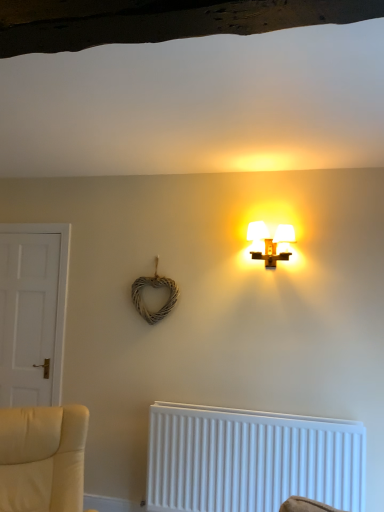
Find the location of `white plastic radiator at lower center`. white plastic radiator at lower center is located at coordinates (251, 460).

What do you see at coordinates (270, 242) in the screenshot?
I see `matte white lamp at upper center` at bounding box center [270, 242].

This screenshot has height=512, width=384. Describe the element at coordinates (28, 317) in the screenshot. I see `white matte door at left` at that location.

The height and width of the screenshot is (512, 384). Identify the location of white plastic radiator at lower center. tap(251, 460).

Is the surface of white plastic radiator at lower center in direct contact with white matte door at left?

They are not placed beside each other.

Does white plastic radiator at lower center have a lesser width compared to white matte door at left?

No, white plastic radiator at lower center is not thinner than white matte door at left.

Identify the location of radiator below the white matte door at left (from the image's perspective). This screenshot has width=384, height=512. (251, 460).

Considering the sizes of objects matte white lamp at upper center and white plastic radiator at lower center in the image provided, who is shorter, matte white lamp at upper center or white plastic radiator at lower center?

With less height is matte white lamp at upper center.

Is matte white lamp at upper center at the left side of white plastic radiator at lower center?

Incorrect, matte white lamp at upper center is not on the left side of white plastic radiator at lower center.

Is matte white lamp at upper center inside or outside of white plastic radiator at lower center?

matte white lamp at upper center lies outside white plastic radiator at lower center.

Could you tell me if matte white lamp at upper center is turned towards white plastic radiator at lower center?

No, matte white lamp at upper center does not turn towards white plastic radiator at lower center.

Is white matte door at left completely or partially outside of matte white lamp at upper center?

white matte door at left lies outside matte white lamp at upper center's area.

Is white matte door at left taller or shorter than matte white lamp at upper center?

Clearly, white matte door at left is taller compared to matte white lamp at upper center.

Is white matte door at left bigger than matte white lamp at upper center?

Correct, white matte door at left is larger in size than matte white lamp at upper center.

How distant is white matte door at left from matte white lamp at upper center?

white matte door at left and matte white lamp at upper center are 1.74 meters apart from each other.

Can you confirm if matte white lamp at upper center is taller than white matte door at left?

Incorrect, the height of matte white lamp at upper center is not larger of that of white matte door at left.

Does matte white lamp at upper center have a lesser width compared to white matte door at left?

Incorrect, the width of matte white lamp at upper center is not less than that of white matte door at left.

Would you say matte white lamp at upper center is to the left or to the right of white matte door at left in the picture?

From the image, it's evident that matte white lamp at upper center is to the right of white matte door at left.

Which object is more forward, matte white lamp at upper center or white matte door at left?

matte white lamp at upper center is more forward.

How many degrees apart are the facing directions of white matte door at left and white plastic radiator at lower center?

The facing directions of white matte door at left and white plastic radiator at lower center are 1.1 degrees apart.

Which is more distant, (10, 253) or (229, 443)?

The point (10, 253) is farther.

From the image's perspective, is white matte door at left located beneath white plastic radiator at lower center?

No.

From a real-world perspective, is white matte door at left beneath white plastic radiator at lower center?

No, from a real-world perspective, white matte door at left is not beneath white plastic radiator at lower center.

Identify the location of radiator below the matte white lamp at upper center (from the image's perspective). The width and height of the screenshot is (384, 512). (251, 460).

Considering the sizes of white plastic radiator at lower center and matte white lamp at upper center in the image, is white plastic radiator at lower center taller or shorter than matte white lamp at upper center?

Considering their sizes, white plastic radiator at lower center has more height than matte white lamp at upper center.

Based on the photo, is white plastic radiator at lower center next to matte white lamp at upper center?

No, white plastic radiator at lower center is not with matte white lamp at upper center.

Is point (190, 487) farther from camera compared to point (270, 259)?

Yes, point (190, 487) is farther from viewer.

Image resolution: width=384 pixels, height=512 pixels. I want to click on radiator on the right of white matte door at left, so click(x=251, y=460).

I want to click on radiator located in front of the matte white lamp at upper center, so click(251, 460).

Looking at the image, which one is located further to white plastic radiator at lower center, matte white lamp at upper center or white matte door at left?

white matte door at left.

Considering their positions, is white matte door at left positioned further to matte white lamp at upper center than white plastic radiator at lower center?

white matte door at left lies further to matte white lamp at upper center than the other object.

From the image, which object appears to be nearer to white matte door at left, matte white lamp at upper center or white plastic radiator at lower center?

white plastic radiator at lower center.

Based on their spatial positions, is white matte door at left or matte white lamp at upper center closer to white plastic radiator at lower center?

matte white lamp at upper center is closer to white plastic radiator at lower center.

Estimate the real-world distances between objects in this image. Which object is closer to matte white lamp at upper center, white plastic radiator at lower center or white matte door at left?

white plastic radiator at lower center is positioned closer to the anchor matte white lamp at upper center.

Estimate the real-world distances between objects in this image. Which object is closer to white matte door at left, white plastic radiator at lower center or matte white lamp at upper center?

Among the two, white plastic radiator at lower center is located nearer to white matte door at left.

Find the location of a particular element. Image resolution: width=384 pixels, height=512 pixels. radiator situated between white matte door at left and matte white lamp at upper center from left to right is located at coordinates (x=251, y=460).